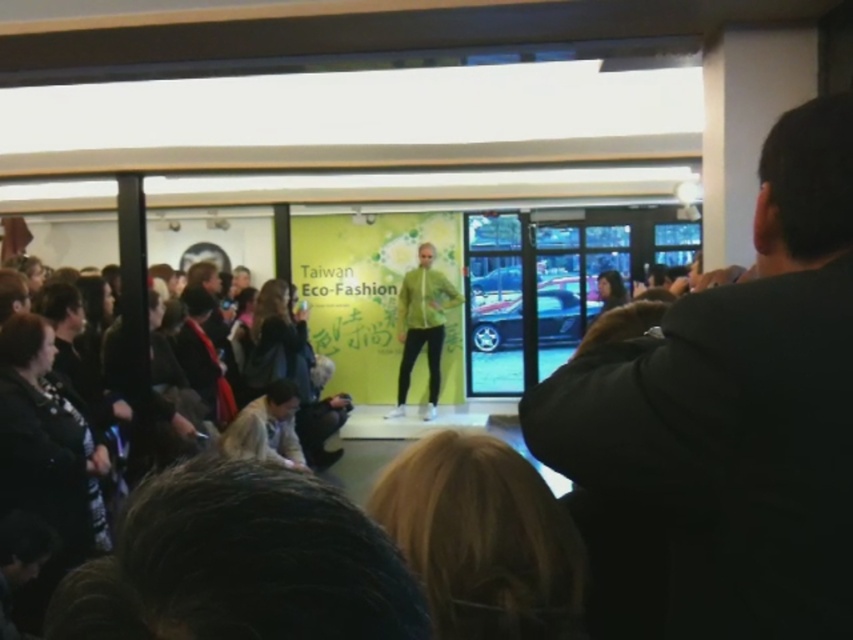
Is point (747, 486) positioned before point (67, 525)?

Yes, point (747, 486) is closer to viewer.

Find the location of a particular element. The image size is (853, 640). black jacket at right is located at coordinates tap(726, 426).

The height and width of the screenshot is (640, 853). I want to click on black jacket at right, so click(x=726, y=426).

Is the position of dark brown leather jacket at lower left more distant than that of green matte jacket at center?

No, dark brown leather jacket at lower left is in front of green matte jacket at center.

Does point (36, 600) come in front of point (415, 285)?

Yes, it is.

The height and width of the screenshot is (640, 853). What are the coordinates of `dark brown leather jacket at lower left` in the screenshot? It's located at (47, 456).

Between black jacket at right and green matte jacket at center, which one is positioned lower?

green matte jacket at center

Measure the distance from black jacket at right to green matte jacket at center.

black jacket at right is 6.68 meters away from green matte jacket at center.

Measure the distance between black jacket at right and camera.

34.60 inches

Locate an element on the screen. This screenshot has width=853, height=640. black jacket at right is located at coordinates (726, 426).